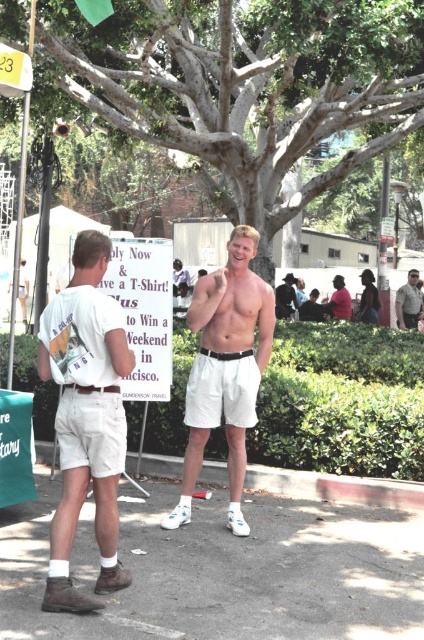
Question: Is white paper sign at center positioned before shiny black jacket at upper center?

Choices:
 (A) yes
 (B) no

Answer: (A)

Question: Estimate the real-world distances between objects in this image. Which object is closer to the light brown leather belt at center?

Choices:
 (A) light brown leather jacket at upper right
 (B) shiny black jacket at upper center
 (C) matte pink shirt at center

Answer: (C)

Question: Which of the following is the closest to the observer?

Choices:
 (A) matte pink shirt at center
 (B) light brown leather belt at center

Answer: (A)

Question: Which point is closer to the camera taking this photo?

Choices:
 (A) (412, 323)
 (B) (159, 252)

Answer: (B)

Question: Can you confirm if white cotton shorts at center is positioned above light brown leather jacket at upper right?

Choices:
 (A) no
 (B) yes

Answer: (A)

Question: Does matte pink shirt at center appear under light brown leather belt at center?

Choices:
 (A) no
 (B) yes

Answer: (A)